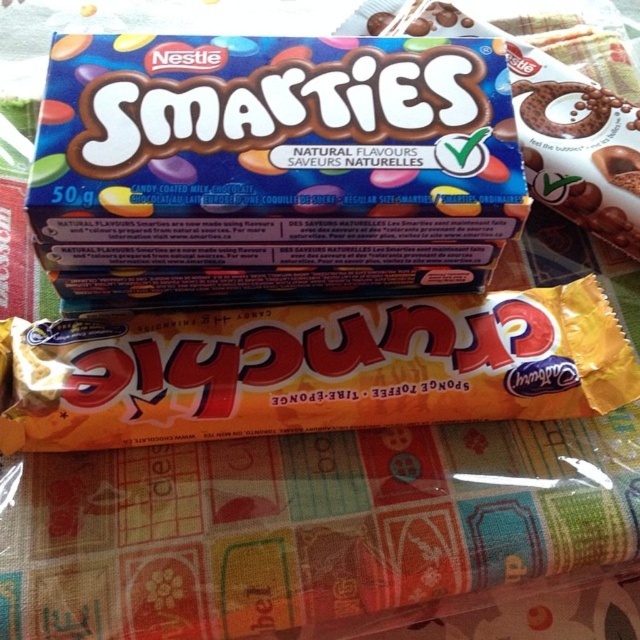
You are organizing a candy display and need to place the matte chocolate smarties at upper center and the yellow sponge toffee at center. According to the image, which candy is positioned to the left of the other?

The matte chocolate smarties at upper center is to the left of the yellow sponge toffee at center.

You are a child who wants to choose a candy to eat. You have two options in front of you on the table. Which one is larger in size between the yellow sponge toffee at center and the smooth chocolate bar at center?

The yellow sponge toffee at center is bigger than the smooth chocolate bar at center, so you should choose the yellow sponge toffee at center if you want a larger candy.